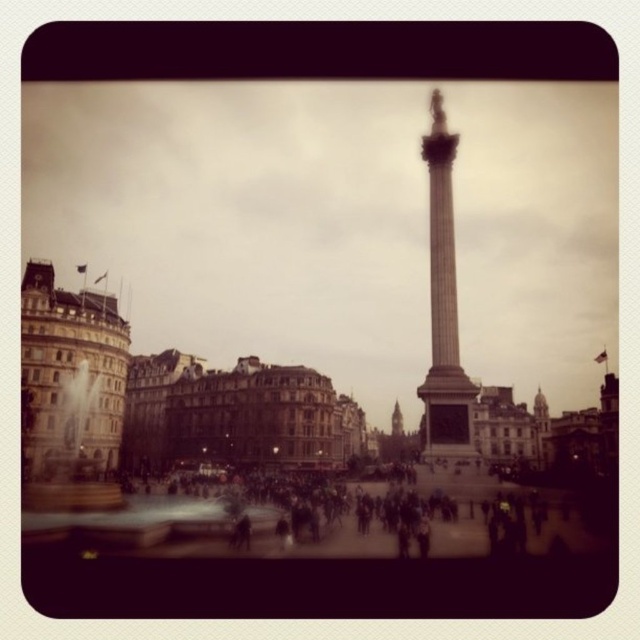
Is the position of dark clothing crowd at center more distant than that of smooth stone column at center?

No, dark clothing crowd at center is closer to the viewer.

Is dark clothing crowd at center positioned in front of smooth stone column at center?

Yes, it is in front of smooth stone column at center.

Which is in front, point (476, 472) or point (445, 298)?

Positioned in front is point (445, 298).

At what (x,y) coordinates should I click in order to perform the action: click on dark clothing crowd at center. Please return your answer as a coordinate pair (x, y). Looking at the image, I should click on (496, 515).

From the picture: Does dark clothing crowd at center have a larger size compared to stone clock tower at center?

Yes.

Who is more forward, (368, 545) or (396, 416)?

Positioned in front is point (368, 545).

Locate an element on the screen. dark clothing crowd at center is located at coordinates coord(496,515).

Does smooth stone column at center appear over stone clock tower at center?

Yes.

Does smooth stone column at center have a lesser width compared to stone clock tower at center?

In fact, smooth stone column at center might be wider than stone clock tower at center.

Is point (436, 262) in front of point (392, 406)?

Yes, it is.

This screenshot has width=640, height=640. I want to click on smooth stone column at center, so click(x=444, y=307).